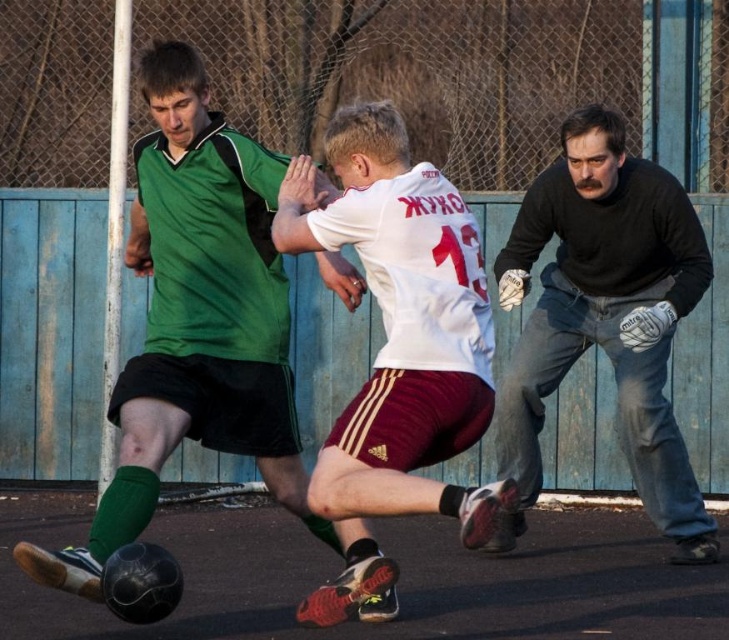
Based on the coordinates provided, where is the white matte jersey at center located in the image?

The white matte jersey at center is located at the coordinates point (399, 324).